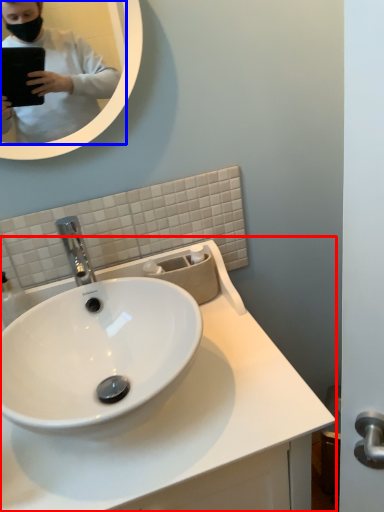
Question: Among these objects, which one is farthest to the camera, sink (highlighted by a red box) or mirror (highlighted by a blue box)?

Choices:
 (A) sink
 (B) mirror

Answer: (B)